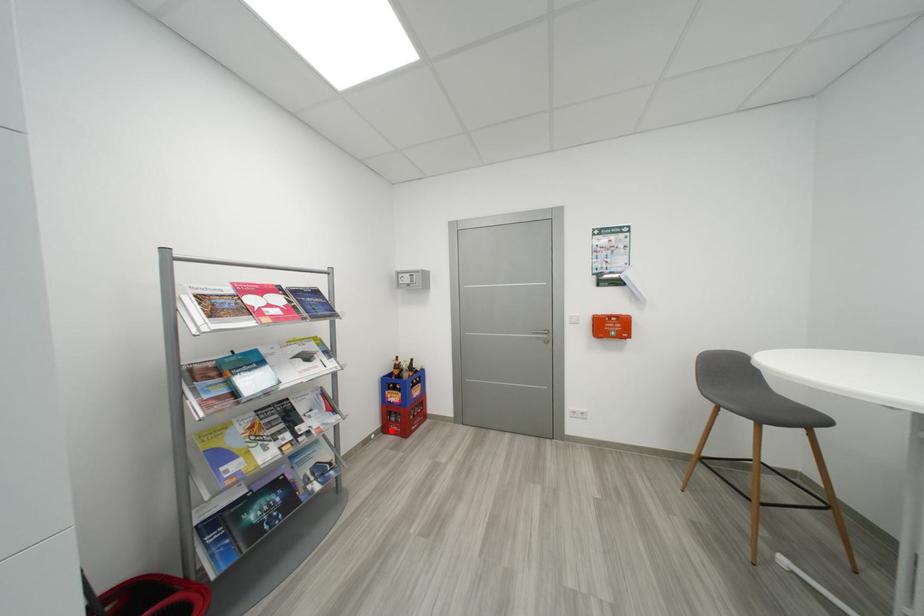
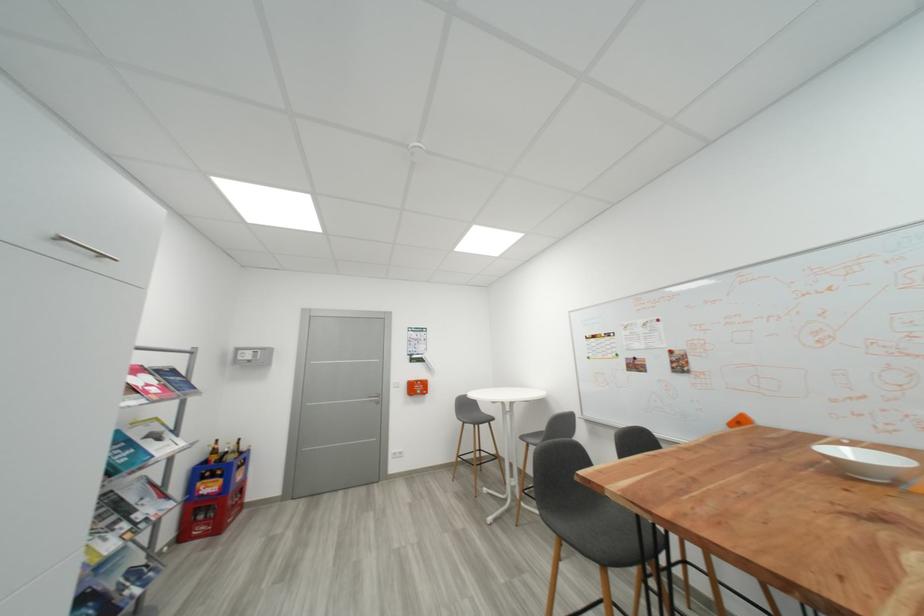
In the second image, find the point that corresponds to the highlighted location in the first image.

(189, 538)